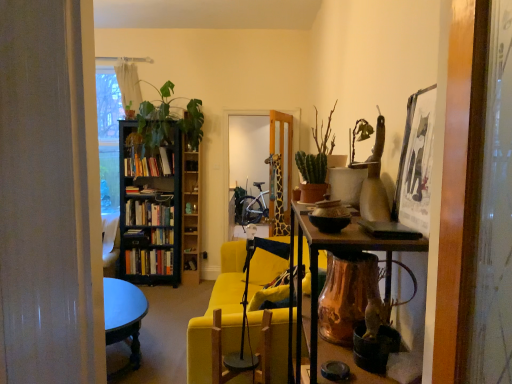
Question: In terms of width, does hardcover book at center, placed as the third book when sorted from top to bottom, look wider or thinner when compared to wooden swivel chair at center?

Choices:
 (A) thin
 (B) wide

Answer: (A)

Question: Do you think hardcover book at center, placed as the third book when sorted from top to bottom, is within wooden swivel chair at center, or outside of it?

Choices:
 (A) outside
 (B) inside

Answer: (A)

Question: Considering the real-world distances, which object is closest to the yellow fabric couch at center?

Choices:
 (A) green leafy plant at left
 (B) hardcover books at left, which is counted as the 2th book, starting from the top
 (C) green matte cactus at center
 (D) hardcover books at left, positioned as the fourth book in top-to-bottom order
 (E) black wooden bookcase at left

Answer: (C)

Question: Estimate the real-world distances between objects in this image. Which object is farther from the hardcover book at center, placed as the third book when sorted from top to bottom?

Choices:
 (A) hardcover books at left, positioned as the fourth book in top-to-bottom order
 (B) hardcover books at left, the fourth book from the bottom
 (C) hardcover books at left, which is counted as the 2th book, starting from the top
 (D) black wooden bookcase at left
 (E) wooden shelf at left

Answer: (B)